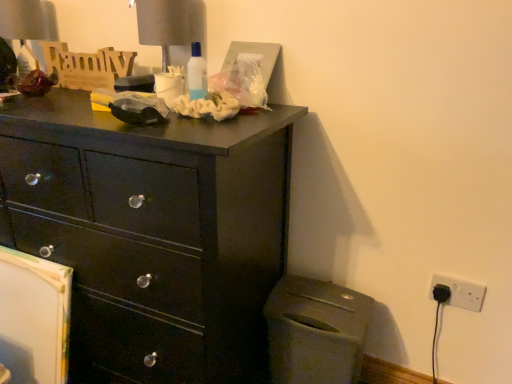
Question: Is matte gray trash can at lower right oriented away from white plastic electric outlet at lower right?

Choices:
 (A) no
 (B) yes

Answer: (A)

Question: Does matte gray trash can at lower right have a smaller size compared to white plastic electric outlet at lower right?

Choices:
 (A) yes
 (B) no

Answer: (B)

Question: Could you tell me if matte gray trash can at lower right is facing white plastic electric outlet at lower right?

Choices:
 (A) yes
 (B) no

Answer: (B)

Question: Can you confirm if matte gray trash can at lower right is positioned to the left of white plastic electric outlet at lower right?

Choices:
 (A) no
 (B) yes

Answer: (B)

Question: Is matte gray trash can at lower right bigger than white plastic electric outlet at lower right?

Choices:
 (A) no
 (B) yes

Answer: (B)

Question: Is matte gray trash can at lower right further to the viewer compared to white plastic electric outlet at lower right?

Choices:
 (A) yes
 (B) no

Answer: (B)

Question: Does matte gray table lamp at upper center, which is the second table lamp in left-to-right order, lie behind matte gray trash can at lower right?

Choices:
 (A) no
 (B) yes

Answer: (B)

Question: Does matte gray table lamp at upper center, which is the second table lamp in left-to-right order, lie in front of matte gray trash can at lower right?

Choices:
 (A) no
 (B) yes

Answer: (A)

Question: Is matte gray table lamp at upper center, the 2th table lamp when ordered from back to front, smaller than matte gray trash can at lower right?

Choices:
 (A) no
 (B) yes

Answer: (B)

Question: Would you say matte gray table lamp at upper center, the 2th table lamp when ordered from back to front, contains matte gray trash can at lower right?

Choices:
 (A) no
 (B) yes

Answer: (A)

Question: From the image's perspective, is matte gray table lamp at upper center, which ranks as the first table lamp in front-to-back order, on matte gray trash can at lower right?

Choices:
 (A) yes
 (B) no

Answer: (A)

Question: From the image's perspective, is matte gray table lamp at upper center, which is the second table lamp in left-to-right order, beneath matte gray trash can at lower right?

Choices:
 (A) yes
 (B) no

Answer: (B)

Question: From the image's perspective, would you say white plastic electric outlet at lower right is shown under matte gray trash can at lower right?

Choices:
 (A) yes
 (B) no

Answer: (B)